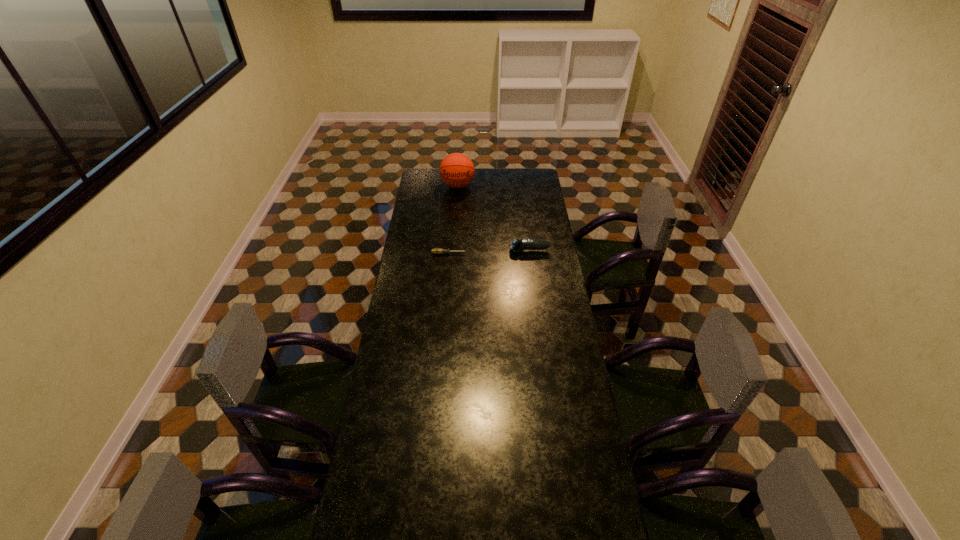
Identify the location of the tallest object. (457, 170).

You are a GUI agent. You are given a task and a screenshot of the screen. Output one action in this format:
    pyautogui.click(x=<x>, y=<y>)
    Task: Click on the basketball
    
    Given the screenshot: What is the action you would take?
    pyautogui.click(x=457, y=170)

The height and width of the screenshot is (540, 960). What are the coordinates of `the second tallest object` in the screenshot? It's located at (516, 245).

Find the location of a particular element. the rightmost object is located at coordinates (516, 245).

Locate an element on the screen. the shortest object is located at coordinates 436,251.

At what (x,y) coordinates should I click in order to perform the action: click on vacant space located 0.300m on the side with logo of the tallest object. Please return your answer as a coordinate pair (x, y). Image resolution: width=960 pixels, height=540 pixels. Looking at the image, I should click on (455, 225).

Identify the location of vacant space located 0.200m on the head of the second tallest object. (469, 251).

This screenshot has width=960, height=540. Find the location of `vacant space situated on the head of the second tallest object`. vacant space situated on the head of the second tallest object is located at coordinates (430, 251).

Find the location of a particular element. The image size is (960, 540). vacant space located 0.080m on the head of the second tallest object is located at coordinates (493, 251).

Where is `free space located at the tip of the screwdriver`? The width and height of the screenshot is (960, 540). free space located at the tip of the screwdriver is located at coordinates (544, 254).